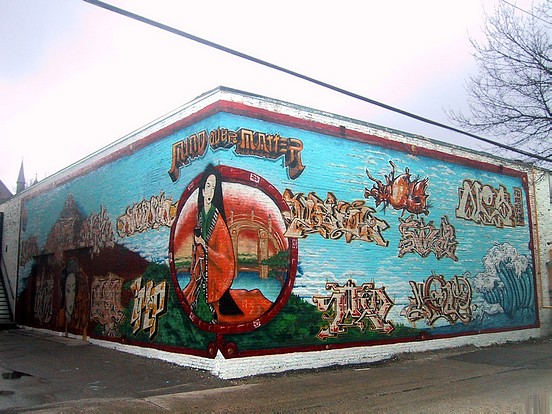
Where is `wall`? Image resolution: width=552 pixels, height=414 pixels. wall is located at coordinates (341, 166), (145, 174).